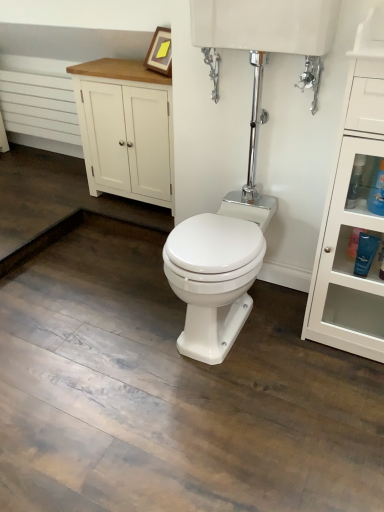
Question: Is the position of white glossy tank at upper center less distant than that of white glossy cabinet at right?

Choices:
 (A) no
 (B) yes

Answer: (A)

Question: Is white glossy tank at upper center not near white glossy cabinet at right?

Choices:
 (A) yes
 (B) no

Answer: (B)

Question: Is white glossy tank at upper center taller than white glossy cabinet at right?

Choices:
 (A) yes
 (B) no

Answer: (B)

Question: From the image's perspective, is white glossy tank at upper center above white glossy cabinet at right?

Choices:
 (A) yes
 (B) no

Answer: (A)

Question: Does white glossy tank at upper center contain white glossy cabinet at right?

Choices:
 (A) no
 (B) yes

Answer: (A)

Question: Considering the relative positions of white glossy tank at upper center and white glossy cabinet at right in the image provided, is white glossy tank at upper center behind white glossy cabinet at right?

Choices:
 (A) no
 (B) yes

Answer: (B)

Question: Can you confirm if white glossy tank at upper center is shorter than blue glossy bottle at right?

Choices:
 (A) yes
 (B) no

Answer: (A)

Question: Is white glossy tank at upper center not near blue glossy bottle at right?

Choices:
 (A) yes
 (B) no

Answer: (B)

Question: Is white glossy tank at upper center positioned with its back to blue glossy bottle at right?

Choices:
 (A) yes
 (B) no

Answer: (B)

Question: From a real-world perspective, is white glossy tank at upper center located higher than blue glossy bottle at right?

Choices:
 (A) yes
 (B) no

Answer: (A)

Question: Can you confirm if white glossy tank at upper center is positioned to the right of blue glossy bottle at right?

Choices:
 (A) yes
 (B) no

Answer: (B)

Question: From a real-world perspective, does white glossy tank at upper center sit lower than blue glossy bottle at right?

Choices:
 (A) yes
 (B) no

Answer: (B)

Question: Considering the relative sizes of white painted wood cabinet at upper left and white glossy cabinet at right in the image provided, is white painted wood cabinet at upper left wider than white glossy cabinet at right?

Choices:
 (A) no
 (B) yes

Answer: (A)